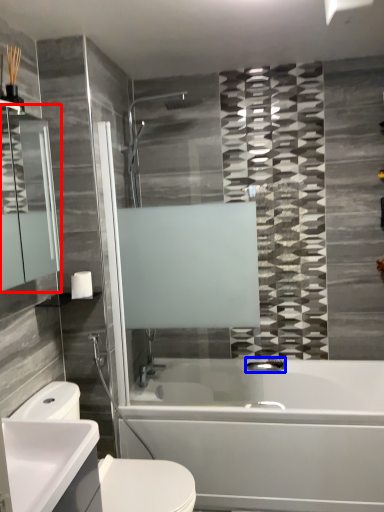
Question: Which object is further to the camera taking this photo, mirror (highlighted by a red box) or plumbing fixture (highlighted by a blue box)?

Choices:
 (A) mirror
 (B) plumbing fixture

Answer: (B)